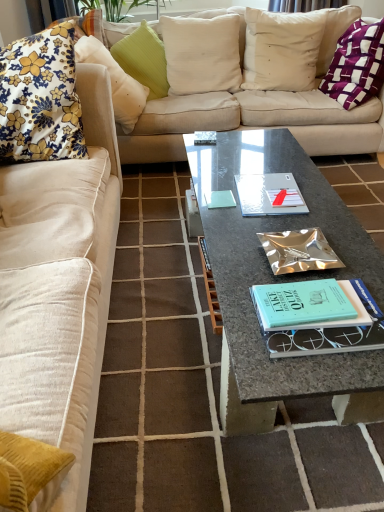
This screenshot has width=384, height=512. I want to click on vacant space behind silver metallic notebook at center, so click(245, 165).